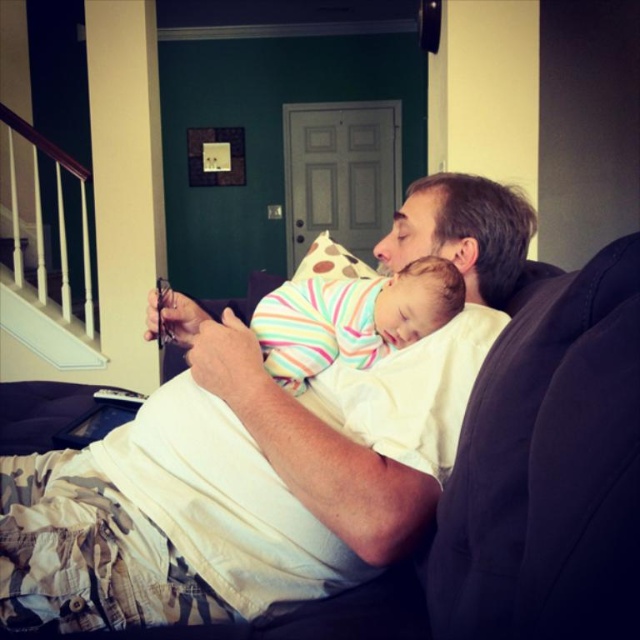
Who is more forward, (212, 605) or (424, 333)?

Positioned in front is point (212, 605).

Is point (369, 557) farther from camera compared to point (449, 317)?

No, it is in front of (449, 317).

The image size is (640, 640). Describe the element at coordinates (262, 454) in the screenshot. I see `white cotton shirt at center` at that location.

Locate an element on the screen. white cotton shirt at center is located at coordinates (262, 454).